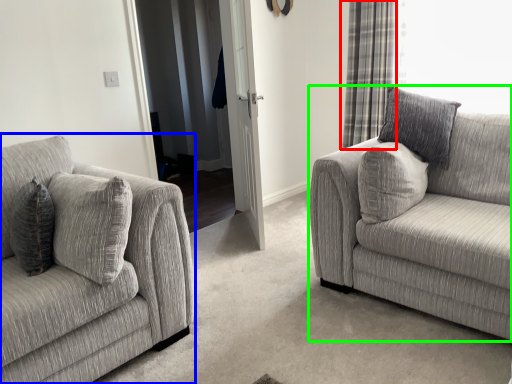
Question: Which is nearer to the curtain (highlighted by a red box)? studio couch (highlighted by a blue box) or studio couch (highlighted by a green box).

Choices:
 (A) studio couch
 (B) studio couch

Answer: (B)